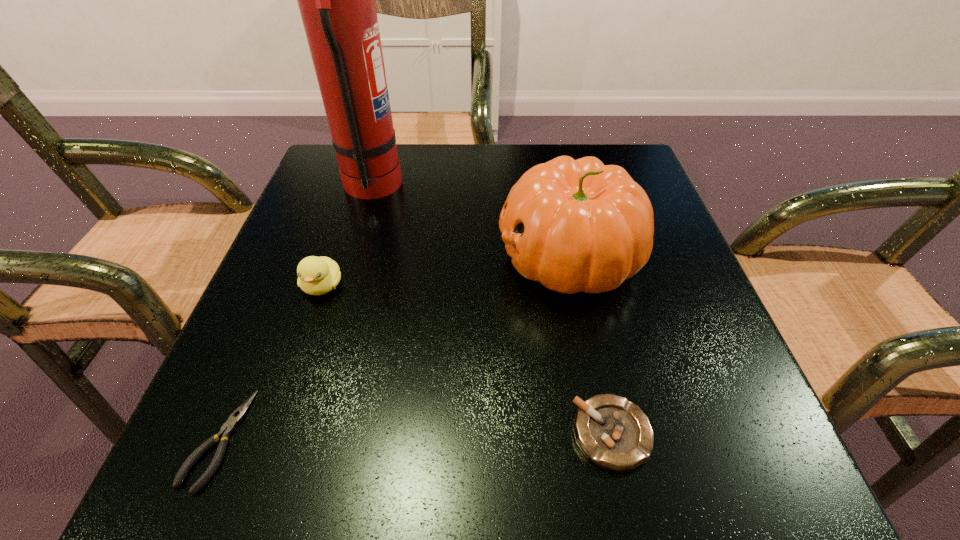
Find the location of a particular element. free space between the fourth shortest object and the fourth tallest object is located at coordinates click(590, 345).

Identify the location of vacant area that lies between the pumpkin and the second shortest object. [590, 345].

Locate an element on the screen. The width and height of the screenshot is (960, 540). object that can be found as the second closest to the duckling is located at coordinates (336, 0).

The height and width of the screenshot is (540, 960). What are the coordinates of `the closest object relative to the third shortest object` in the screenshot? It's located at (228, 428).

This screenshot has height=540, width=960. Identify the location of vacant region that satisfies the following two spatial constraints: 1. at the beak of the ashtray; 2. on the right side of the third shortest object. (273, 434).

The height and width of the screenshot is (540, 960). Identify the location of vacant area in the image that satisfies the following two spatial constraints: 1. on the carved face of the pumpkin; 2. at the beak of the third shortest object. (575, 286).

Image resolution: width=960 pixels, height=540 pixels. What are the coordinates of `free space that satisfies the following two spatial constraints: 1. on the label side of the farthest object; 2. on the right side of the ashtray` in the screenshot? It's located at (299, 434).

This screenshot has height=540, width=960. I want to click on vacant area that satisfies the following two spatial constraints: 1. on the back side of the second shortest object; 2. on the label side of the fire extinguisher, so click(559, 187).

This screenshot has width=960, height=540. Find the location of `free location that satisfies the following two spatial constraints: 1. on the carved face of the second tallest object; 2. at the beak of the duckling`. free location that satisfies the following two spatial constraints: 1. on the carved face of the second tallest object; 2. at the beak of the duckling is located at coordinates (575, 286).

Find the location of a particular element. vacant area in the image that satisfies the following two spatial constraints: 1. on the carved face of the fourth shortest object; 2. at the beak of the duckling is located at coordinates (575, 286).